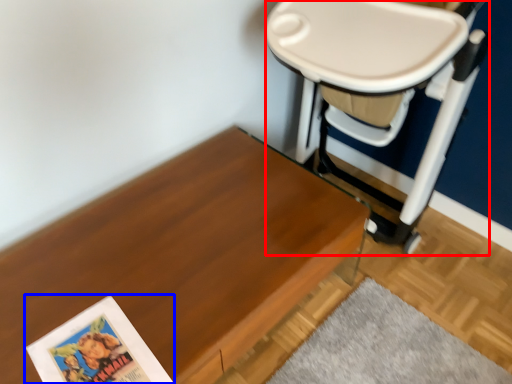
Question: Which of the following is the closest to the observer, swivel chair (highlighted by a red box) or paperback book (highlighted by a blue box)?

Choices:
 (A) swivel chair
 (B) paperback book

Answer: (A)